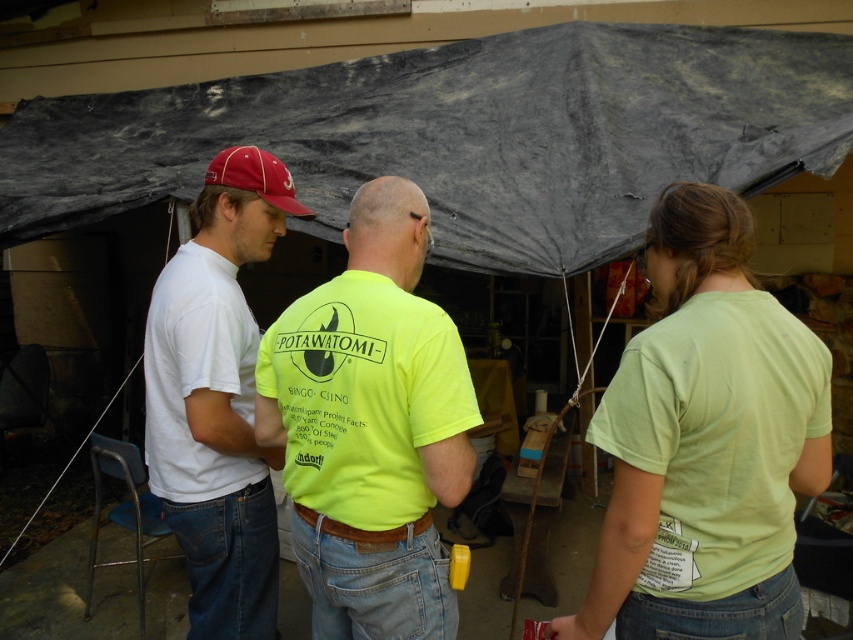
What is the significance of the point at coordinates (706,442) in the image?

The point at coordinates (706,442) marks the location of the lime green tshirt at center.